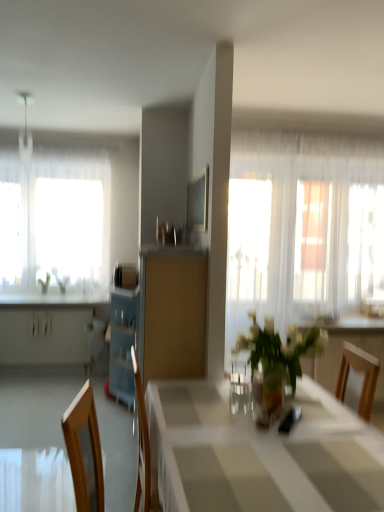
Question: From a real-world perspective, is white glossy table at center physically located above or below translucent glass window at left?

Choices:
 (A) below
 (B) above

Answer: (A)

Question: From the image's perspective, is white glossy table at center above or below translucent glass window at left?

Choices:
 (A) below
 (B) above

Answer: (A)

Question: Which object is the closest to the translucent glass vase at center?

Choices:
 (A) green leafy plant at left
 (B) translucent glass window at left
 (C) wooden chair at right
 (D) matte wood cabinet at center
 (E) white matte radiator at left

Answer: (C)

Question: Which object is the farthest from the translucent glass vase at center?

Choices:
 (A) white glossy countertop at left
 (B) translucent glass window at left
 (C) wooden chair at right
 (D) white glossy table at center
 (E) white matte radiator at left

Answer: (E)